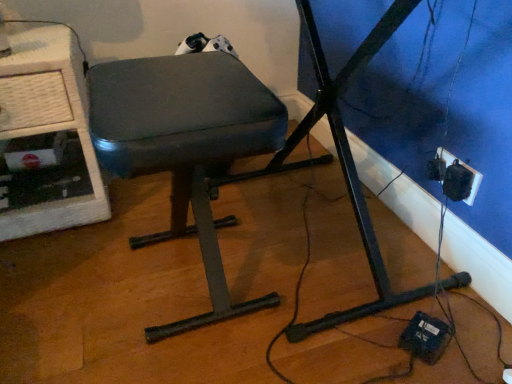
Find the location of a particular element. This screenshot has width=512, height=384. free space on the front side of white textured computer desk at left is located at coordinates (54, 276).